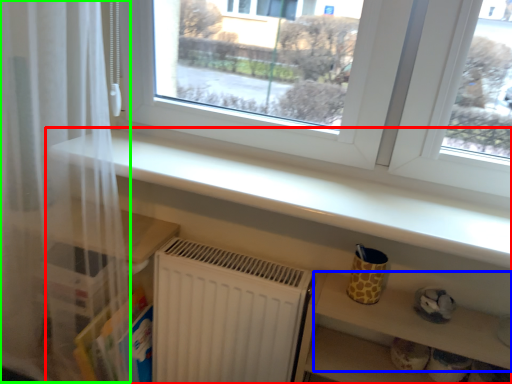
Question: Considering the real-world distances, which object is closest to shelf (highlighted by a red box)? shelf (highlighted by a blue box) or curtain (highlighted by a green box).

Choices:
 (A) shelf
 (B) curtain

Answer: (A)